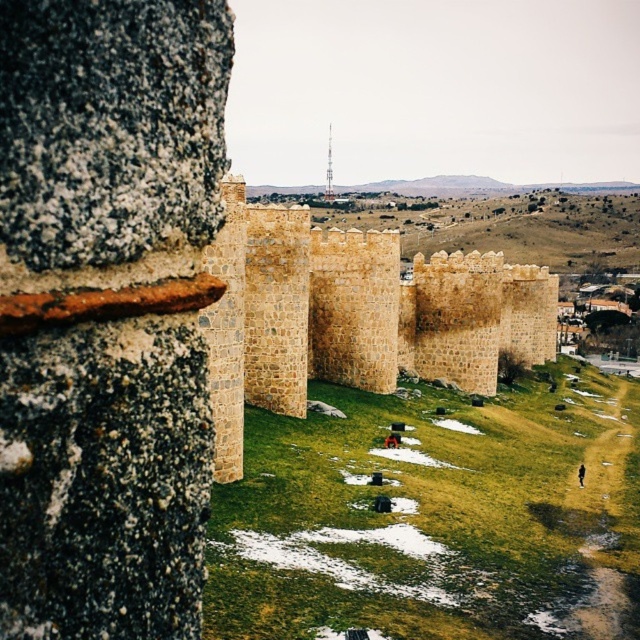
Is brown stone wall at center below smooth concrete tower at center?

Yes, brown stone wall at center is below smooth concrete tower at center.

Find the location of a particular element. This screenshot has height=640, width=640. brown stone wall at center is located at coordinates (352, 316).